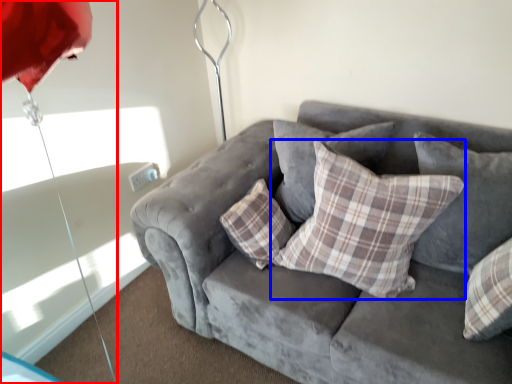
Question: Which of the following is the farthest to the observer, umbrella (highlighted by a red box) or pillow (highlighted by a blue box)?

Choices:
 (A) umbrella
 (B) pillow

Answer: (B)